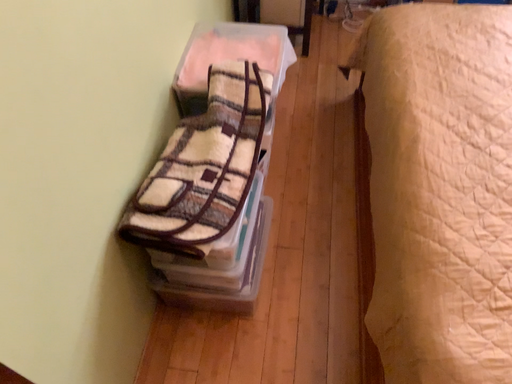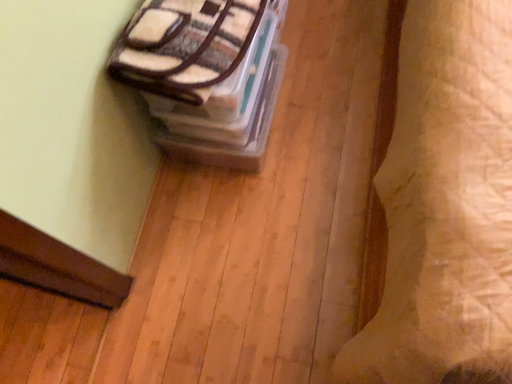
Question: How did the camera likely rotate when shooting the video?

Choices:
 (A) rotated upward
 (B) rotated downward

Answer: (B)